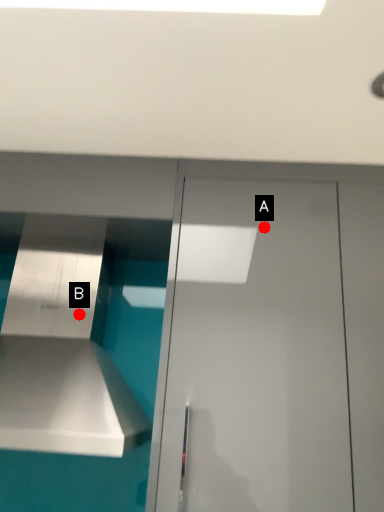
Question: Two points are circled on the image, labeled by A and B beside each circle. Which point is closer to the camera?

Choices:
 (A) A is closer
 (B) B is closer

Answer: (A)